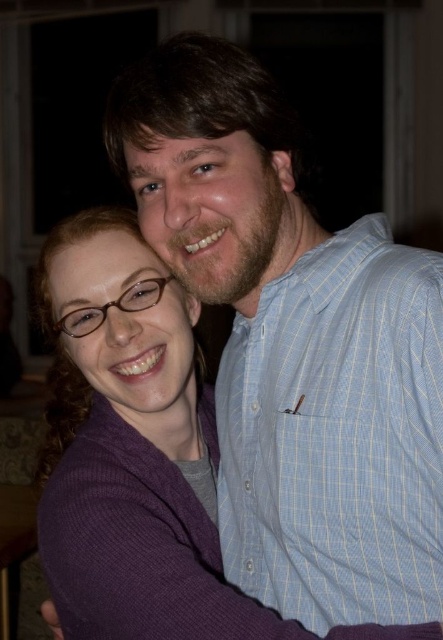
Does blue plaid shirt at center appear under light blue striped shirt at center?

No, blue plaid shirt at center is not below light blue striped shirt at center.

Can you confirm if blue plaid shirt at center is shorter than light blue striped shirt at center?

No.

Does point (276, 468) come farther from viewer compared to point (348, 468)?

Yes, point (276, 468) is behind point (348, 468).

You are a GUI agent. You are given a task and a screenshot of the screen. Output one action in this format:
    pyautogui.click(x=<x>, y=<y>)
    Task: Click on the blue plaid shirt at center
    This screenshot has height=640, width=443.
    Given the screenshot: What is the action you would take?
    pyautogui.click(x=295, y=346)